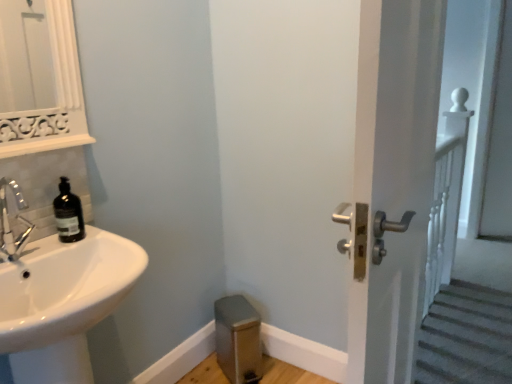
Question: Can you confirm if matte black soap dispenser at left is bigger than white glossy sink at lower left?

Choices:
 (A) no
 (B) yes

Answer: (A)

Question: Is matte black soap dispenser at left to the left of white glossy sink at lower left from the viewer's perspective?

Choices:
 (A) yes
 (B) no

Answer: (A)

Question: Is matte black soap dispenser at left outside of white glossy sink at lower left?

Choices:
 (A) yes
 (B) no

Answer: (A)

Question: Does matte black soap dispenser at left have a lesser width compared to white glossy sink at lower left?

Choices:
 (A) no
 (B) yes

Answer: (B)

Question: Is the position of matte black soap dispenser at left more distant than that of white glossy sink at lower left?

Choices:
 (A) no
 (B) yes

Answer: (B)

Question: Do you think white glossy door handle at right is within brushed metal step stool at lower center, or outside of it?

Choices:
 (A) outside
 (B) inside

Answer: (A)

Question: Looking at their shapes, would you say white glossy door handle at right is wider or thinner than brushed metal step stool at lower center?

Choices:
 (A) wide
 (B) thin

Answer: (B)

Question: In terms of size, does white glossy door handle at right appear bigger or smaller than brushed metal step stool at lower center?

Choices:
 (A) big
 (B) small

Answer: (A)

Question: From their relative heights in the image, would you say white glossy door handle at right is taller or shorter than brushed metal step stool at lower center?

Choices:
 (A) tall
 (B) short

Answer: (A)

Question: From a real-world perspective, is white glossy sink at lower left physically located above or below white glossy door handle at right?

Choices:
 (A) above
 (B) below

Answer: (B)

Question: Considering their positions, is white glossy sink at lower left located in front of or behind white glossy door handle at right?

Choices:
 (A) front
 (B) behind

Answer: (A)

Question: Is white glossy sink at lower left spatially inside white glossy door handle at right, or outside of it?

Choices:
 (A) inside
 (B) outside

Answer: (B)

Question: Is point (104, 249) closer or farther from the camera than point (415, 266)?

Choices:
 (A) farther
 (B) closer

Answer: (A)

Question: Looking at their shapes, would you say white glossy sink at lower left is wider or thinner than matte black soap dispenser at left?

Choices:
 (A) wide
 (B) thin

Answer: (A)

Question: Considering the positions of point [x=36, y=284] and point [x=82, y=220], is point [x=36, y=284] closer or farther from the camera than point [x=82, y=220]?

Choices:
 (A) closer
 (B) farther

Answer: (A)